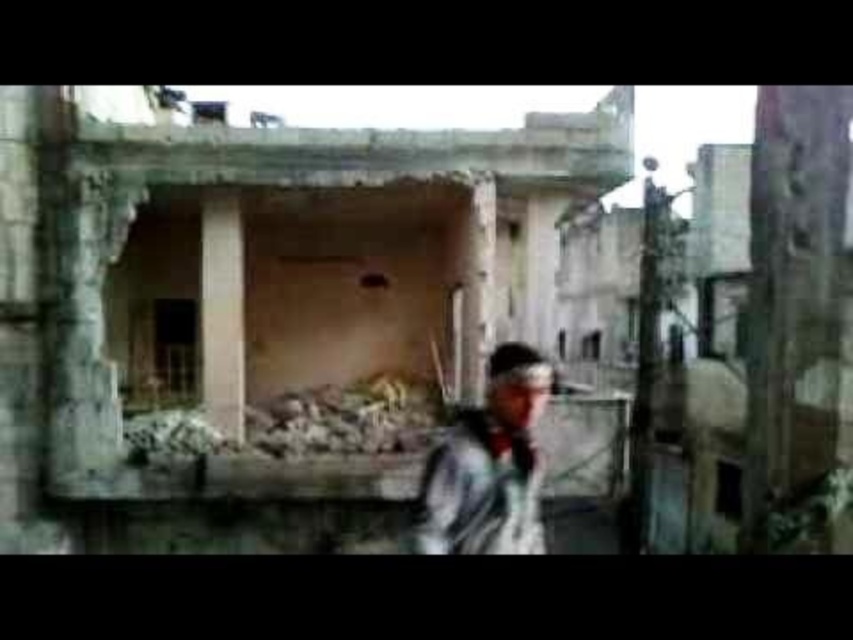
Question: Which of the following is the closest to the observer?

Choices:
 (A) (143, 456)
 (B) (412, 164)

Answer: (B)

Question: In this image, where is concrete rubble at center located relative to gray fabric jacket at center?

Choices:
 (A) below
 (B) above

Answer: (B)

Question: Which of the following is the farthest from the observer?

Choices:
 (A) concrete rubble at center
 (B) brown concrete pillar at center

Answer: (B)

Question: Can you confirm if concrete rubble at center is smaller than brown concrete pillar at center?

Choices:
 (A) yes
 (B) no

Answer: (B)

Question: Is gray fabric jacket at center closer to camera compared to brown concrete pillar at center?

Choices:
 (A) yes
 (B) no

Answer: (A)

Question: Which object appears closest to the camera in this image?

Choices:
 (A) concrete rubble at center
 (B) brown concrete pillar at center
 (C) rusty concrete rubble at center
 (D) gray fabric jacket at center

Answer: (D)